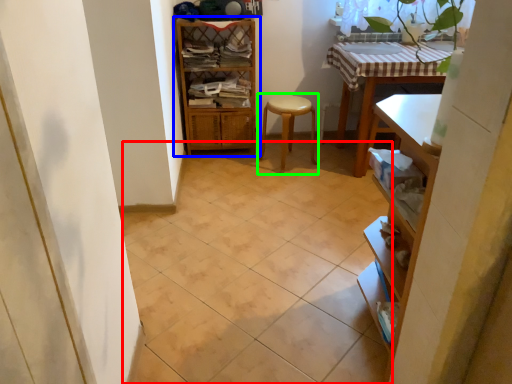
Question: Estimate the real-world distances between objects in this image. Which object is closer to ceramic tile (highlighted by a red box), shelf (highlighted by a blue box) or step stool (highlighted by a green box)?

Choices:
 (A) shelf
 (B) step stool

Answer: (B)